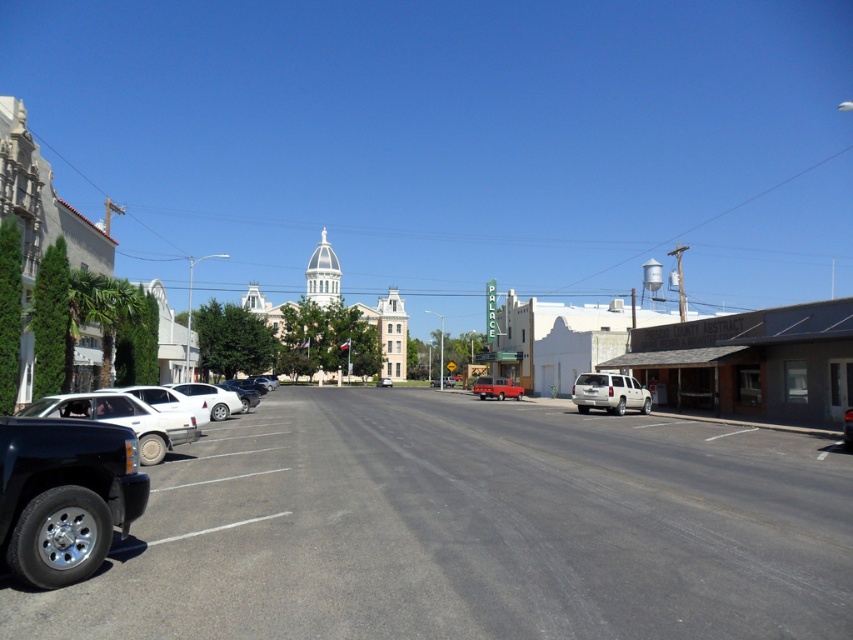
Question: Does white concrete building at center appear on the left side of matte white truck at center?

Choices:
 (A) no
 (B) yes

Answer: (A)

Question: Which point is closer to the camera?

Choices:
 (A) (505, 394)
 (B) (381, 380)

Answer: (A)

Question: Which of the following is the closest to the observer?

Choices:
 (A) metallic silver van at center
 (B) matte white truck at center

Answer: (A)

Question: Observing the image, what is the correct spatial positioning of metallic silver van at center in reference to metallic silver sedan at center?

Choices:
 (A) below
 (B) above

Answer: (B)

Question: Among these objects, which one is nearest to the camera?

Choices:
 (A) matte black truck at left
 (B) matte white truck at center
 (C) white matte suv at center-right

Answer: (A)

Question: Can you confirm if matte black truck at left is wider than metallic silver sedan at center?

Choices:
 (A) yes
 (B) no

Answer: (B)